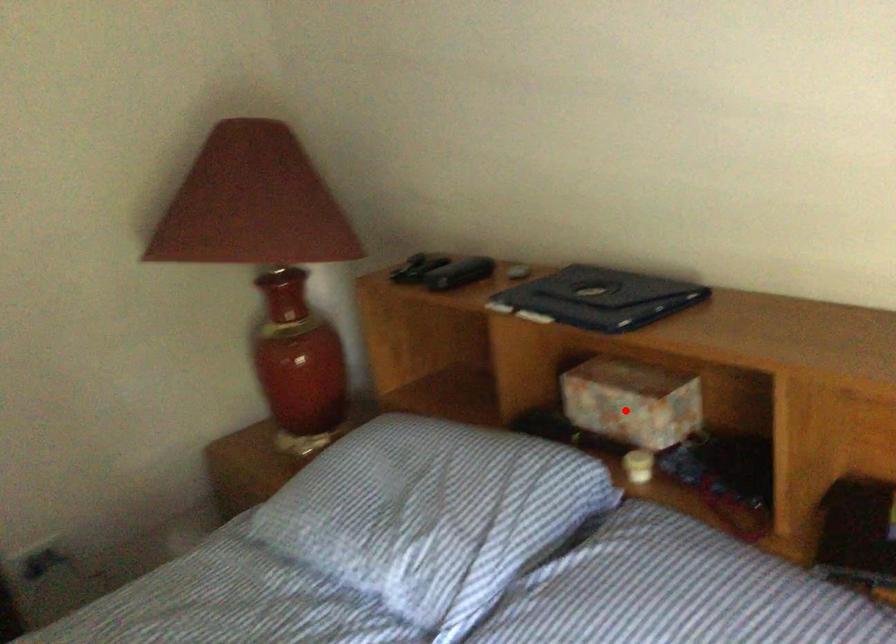
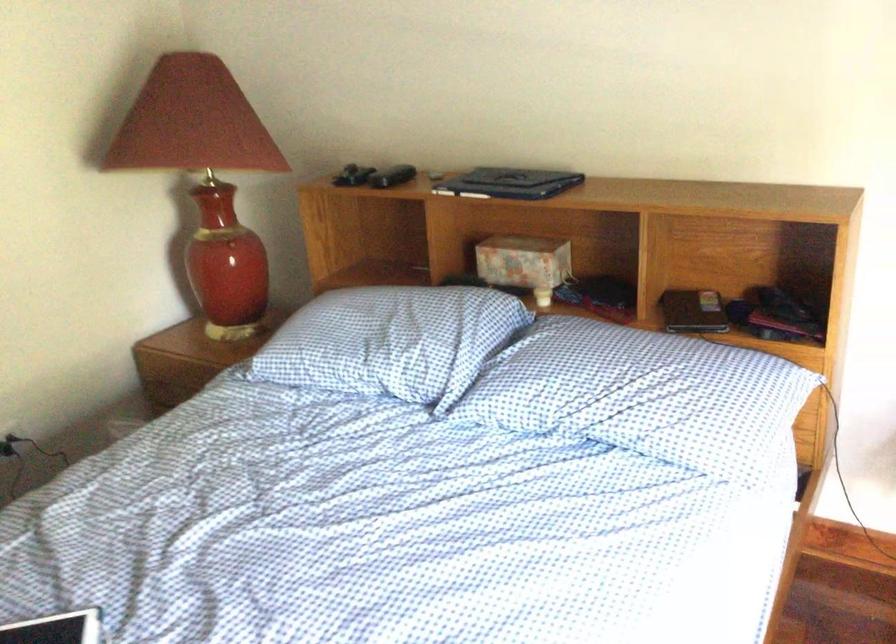
The point at the highlighted location is marked in the first image. Where is the corresponding point in the second image?

(524, 263)